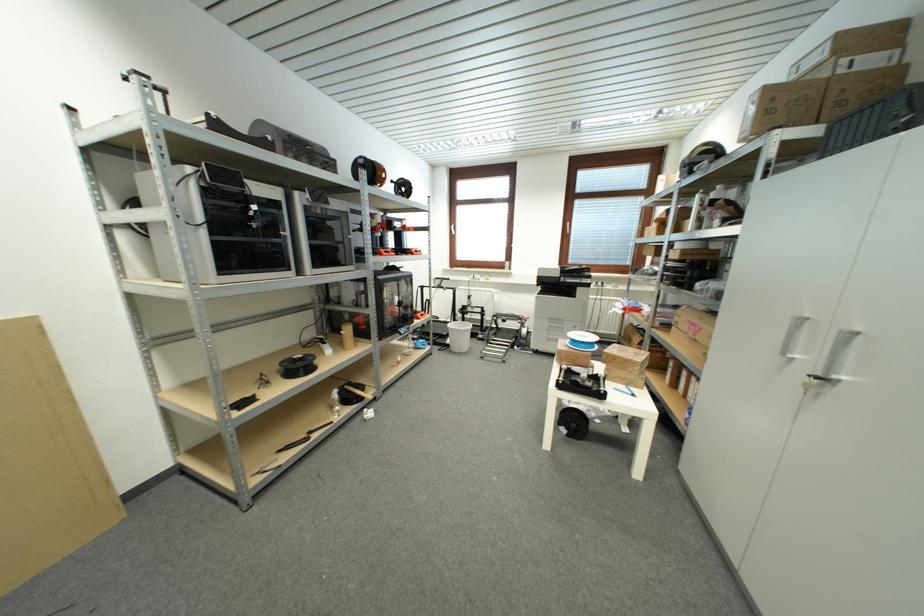
The image size is (924, 616). What do you see at coordinates (569, 233) in the screenshot?
I see `the window handle` at bounding box center [569, 233].